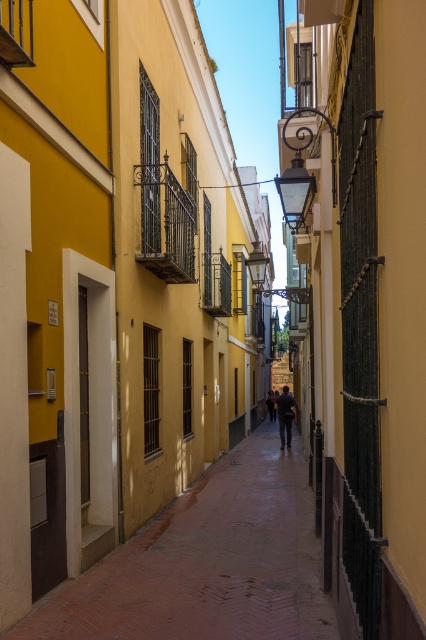
Question: Is brick paved path at center thinner than dark blue jeans at center?

Choices:
 (A) no
 (B) yes

Answer: (A)

Question: Among these points, which one is nearest to the camera?

Choices:
 (A) pyautogui.click(x=78, y=616)
 (B) pyautogui.click(x=284, y=436)

Answer: (A)

Question: Does brick paved path at center appear on the right side of dark blue jeans at center?

Choices:
 (A) yes
 (B) no

Answer: (B)

Question: Which of the following is the farthest from the observer?

Choices:
 (A) brick paved path at center
 (B) dark blue jeans at center

Answer: (B)

Question: Is brick paved path at center below dark blue jeans at center?

Choices:
 (A) yes
 (B) no

Answer: (B)